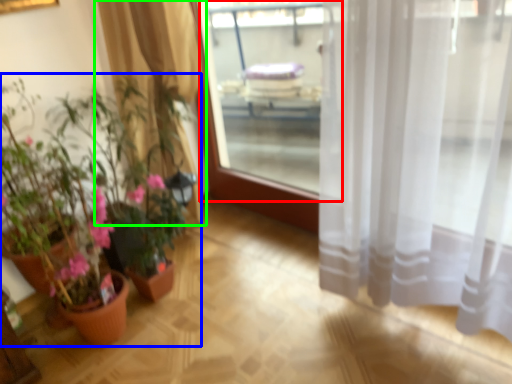
Question: Considering the real-world distances, which object is farthest from window screen (highlighted by a red box)? houseplant (highlighted by a blue box) or curtain (highlighted by a green box)?

Choices:
 (A) houseplant
 (B) curtain

Answer: (A)